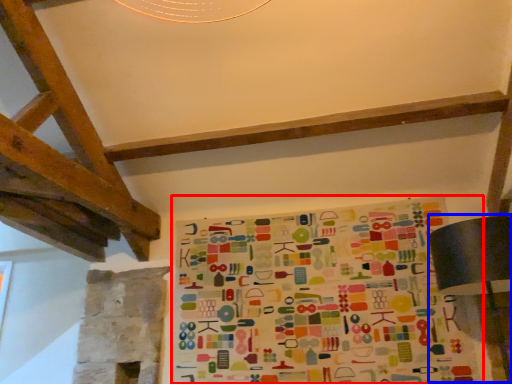
Question: Which point is closer to the camera, bulletin board (highlighted by a red box) or table lamp (highlighted by a blue box)?

Choices:
 (A) bulletin board
 (B) table lamp

Answer: (B)